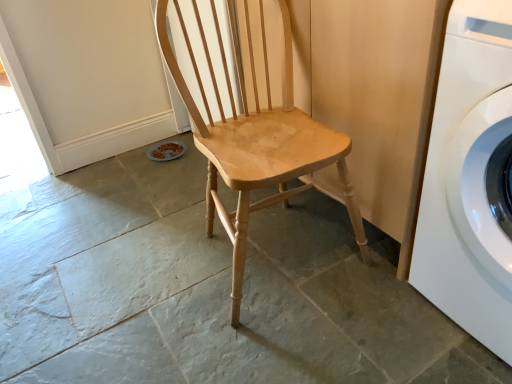
This screenshot has width=512, height=384. What do you see at coordinates (470, 178) in the screenshot? I see `white glossy washing machine at right` at bounding box center [470, 178].

Locate an element on the screen. The height and width of the screenshot is (384, 512). white glossy washing machine at right is located at coordinates (470, 178).

Locate an element on the screen. natural wood chair at center is located at coordinates (256, 138).

Consider the image. What is the approximate height of natural wood chair at center?

It is 86.33 centimeters.

What do you see at coordinates (256, 138) in the screenshot? I see `natural wood chair at center` at bounding box center [256, 138].

Where is `white glossy washing machine at right`? white glossy washing machine at right is located at coordinates (470, 178).

Which is more to the left, white glossy washing machine at right or natural wood chair at center?

Positioned to the left is natural wood chair at center.

In the image, is white glossy washing machine at right positioned in front of or behind natural wood chair at center?

Visually, white glossy washing machine at right is located in front of natural wood chair at center.

Is point (486, 119) closer to camera compared to point (237, 295)?

Yes, point (486, 119) is in front of point (237, 295).

From the image's perspective, is white glossy washing machine at right beneath natural wood chair at center?

Yes.

From a real-world perspective, which is physically above, white glossy washing machine at right or natural wood chair at center?

In real-world perspective, natural wood chair at center is above.

Which object is thinner, white glossy washing machine at right or natural wood chair at center?

natural wood chair at center is thinner.

Can you confirm if white glossy washing machine at right is taller than natural wood chair at center?

No, white glossy washing machine at right is not taller than natural wood chair at center.

Does white glossy washing machine at right have a smaller size compared to natural wood chair at center?

Correct, white glossy washing machine at right occupies less space than natural wood chair at center.

Is white glossy washing machine at right inside the boundaries of natural wood chair at center, or outside?

The correct answer is: outside.

Is white glossy washing machine at right far from natural wood chair at center?

No, there isn't a large distance between white glossy washing machine at right and natural wood chair at center.

Could you tell me if white glossy washing machine at right is facing natural wood chair at center?

No, white glossy washing machine at right is not aimed at natural wood chair at center.

Can you tell me how much white glossy washing machine at right and natural wood chair at center differ in facing direction?

The angular difference between white glossy washing machine at right and natural wood chair at center is 89 degrees.

How far apart are white glossy washing machine at right and natural wood chair at center?

17.05 inches.

Locate an element on the screen. This screenshot has width=512, height=384. washing machine directly beneath the natural wood chair at center (from a real-world perspective) is located at coordinates (470, 178).

Considering the positions of objects natural wood chair at center and white glossy washing machine at right in the image provided, who is more to the left, natural wood chair at center or white glossy washing machine at right?

natural wood chair at center is more to the left.

Does natural wood chair at center lie in front of white glossy washing machine at right?

No, natural wood chair at center is behind white glossy washing machine at right.

Which point is more distant from viewer, (x=316, y=157) or (x=475, y=177)?

The point (x=316, y=157) is more distant.

From the image's perspective, is natural wood chair at center located above or below white glossy washing machine at right?

From the image's perspective, natural wood chair at center appears above white glossy washing machine at right.

From a real-world perspective, between natural wood chair at center and white glossy washing machine at right, who is vertically lower?

white glossy washing machine at right.

Looking at this image, is natural wood chair at center wider than white glossy washing machine at right?

In fact, natural wood chair at center might be narrower than white glossy washing machine at right.

In the scene shown: Can you confirm if natural wood chair at center is taller than white glossy washing machine at right?

Indeed, natural wood chair at center has a greater height compared to white glossy washing machine at right.

In terms of size, does natural wood chair at center appear bigger or smaller than white glossy washing machine at right?

In the image, natural wood chair at center appears to be larger than white glossy washing machine at right.

Is natural wood chair at center outside of white glossy washing machine at right?

natural wood chair at center is positioned outside white glossy washing machine at right.

Is the surface of natural wood chair at center in direct contact with white glossy washing machine at right?

natural wood chair at center and white glossy washing machine at right are not in contact.

Consider the image. Does natural wood chair at center turn towards white glossy washing machine at right?

No, natural wood chair at center is not oriented towards white glossy washing machine at right.

Can you tell me how much natural wood chair at center and white glossy washing machine at right differ in facing direction?

The angle between the facing direction of natural wood chair at center and the facing direction of white glossy washing machine at right is 89 degrees.

Image resolution: width=512 pixels, height=384 pixels. I want to click on chair above the white glossy washing machine at right (from the image's perspective), so click(x=256, y=138).

Locate an element on the screen. This screenshot has width=512, height=384. washing machine below the natural wood chair at center (from a real-world perspective) is located at coordinates (470, 178).

Where is `chair behind the white glossy washing machine at right`? chair behind the white glossy washing machine at right is located at coordinates (256, 138).